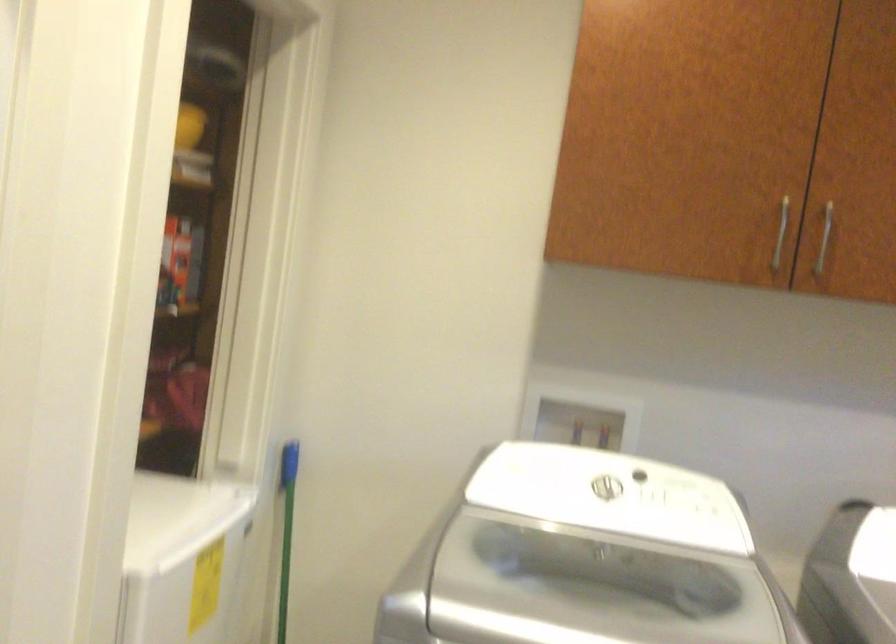
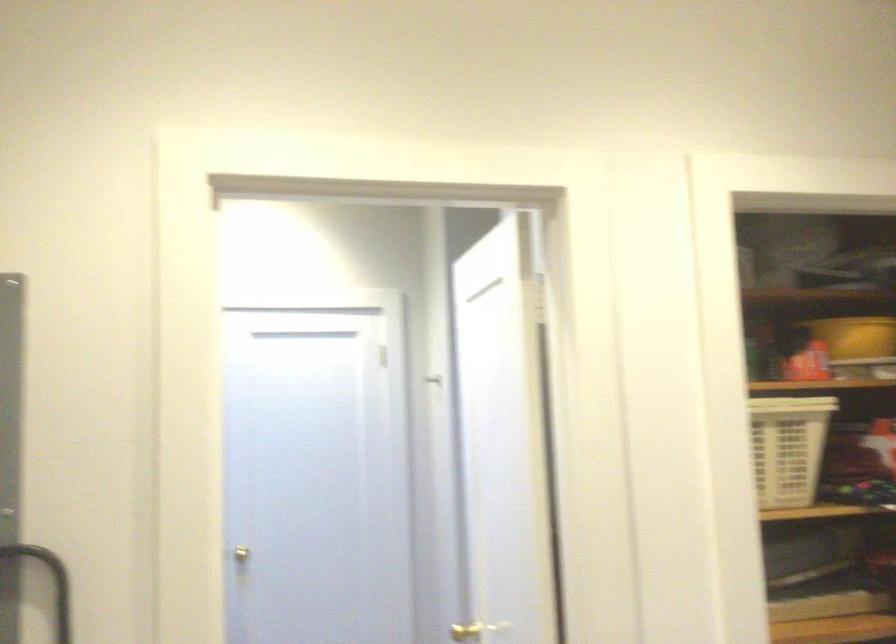
In the second image, find the point that corresponds to point (179, 129) in the first image.

(855, 337)